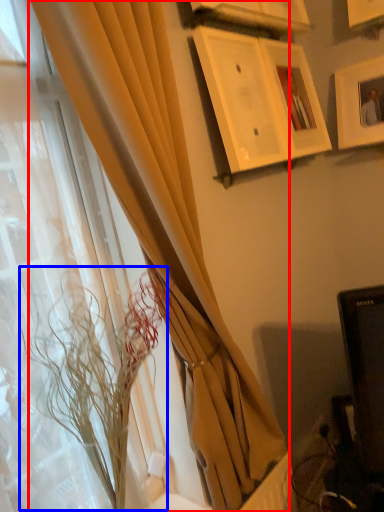
Question: Among these objects, which one is nearest to the camera, curtain (highlighted by a red box) or flower (highlighted by a blue box)?

Choices:
 (A) curtain
 (B) flower

Answer: (A)